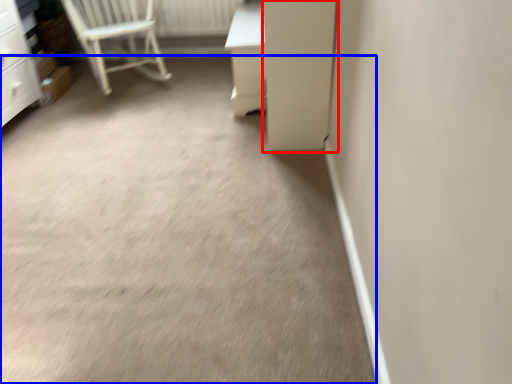
Question: Among these objects, which one is nearest to the camera, screen door (highlighted by a red box) or concrete (highlighted by a blue box)?

Choices:
 (A) screen door
 (B) concrete

Answer: (B)